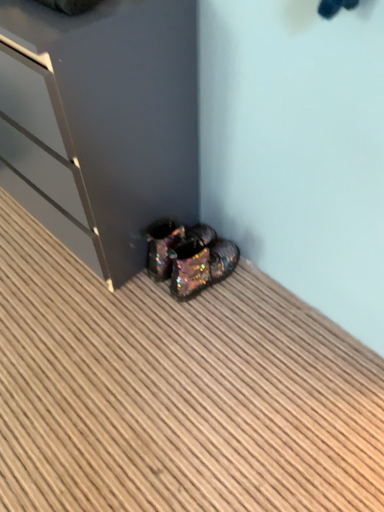
Question: Does iridescent glittery shoes at lower center have a lesser width compared to glossy dark gray dresser at lower left?

Choices:
 (A) no
 (B) yes

Answer: (B)

Question: Does iridescent glittery shoes at lower center have a larger size compared to glossy dark gray dresser at lower left?

Choices:
 (A) no
 (B) yes

Answer: (A)

Question: Considering the relative sizes of iridescent glittery shoes at lower center and glossy dark gray dresser at lower left in the image provided, is iridescent glittery shoes at lower center wider than glossy dark gray dresser at lower left?

Choices:
 (A) no
 (B) yes

Answer: (A)

Question: Does iridescent glittery shoes at lower center appear on the left side of glossy dark gray dresser at lower left?

Choices:
 (A) yes
 (B) no

Answer: (B)

Question: Is iridescent glittery shoes at lower center turned away from glossy dark gray dresser at lower left?

Choices:
 (A) no
 (B) yes

Answer: (A)

Question: Based on their positions, is iridescent metallic shoes at lower center located to the left or right of glossy dark gray dresser at lower left?

Choices:
 (A) left
 (B) right

Answer: (B)

Question: From a real-world perspective, is iridescent metallic shoes at lower center above or below glossy dark gray dresser at lower left?

Choices:
 (A) above
 (B) below

Answer: (B)

Question: Is iridescent metallic shoes at lower center in front of or behind glossy dark gray dresser at lower left in the image?

Choices:
 (A) behind
 (B) front

Answer: (B)

Question: Based on their sizes in the image, would you say iridescent metallic shoes at lower center is bigger or smaller than glossy dark gray dresser at lower left?

Choices:
 (A) small
 (B) big

Answer: (A)

Question: From the image's perspective, is glossy dark gray dresser at lower left above or below iridescent glittery shoes at lower center?

Choices:
 (A) above
 (B) below

Answer: (A)

Question: Visually, is glossy dark gray dresser at lower left positioned to the left or to the right of iridescent glittery shoes at lower center?

Choices:
 (A) right
 (B) left

Answer: (B)

Question: Is glossy dark gray dresser at lower left taller or shorter than iridescent glittery shoes at lower center?

Choices:
 (A) short
 (B) tall

Answer: (B)

Question: In the image, is glossy dark gray dresser at lower left positioned in front of or behind iridescent glittery shoes at lower center?

Choices:
 (A) front
 (B) behind

Answer: (A)

Question: Is point (148, 12) positioned closer to the camera than point (122, 487)?

Choices:
 (A) farther
 (B) closer

Answer: (B)

Question: Considering the positions of glossy dark gray dresser at lower left and iridescent metallic shoes at lower center in the image, is glossy dark gray dresser at lower left wider or thinner than iridescent metallic shoes at lower center?

Choices:
 (A) thin
 (B) wide

Answer: (A)